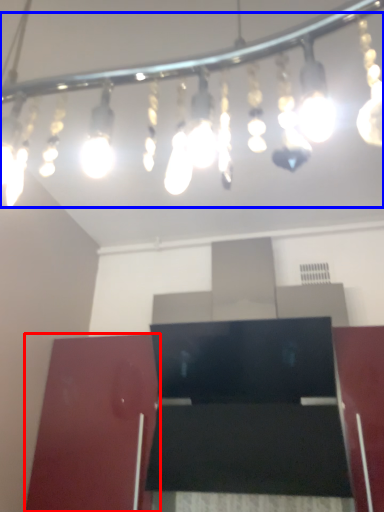
Question: Which object appears farthest to the camera in this image, furniture (highlighted by a red box) or lamp (highlighted by a blue box)?

Choices:
 (A) furniture
 (B) lamp

Answer: (A)